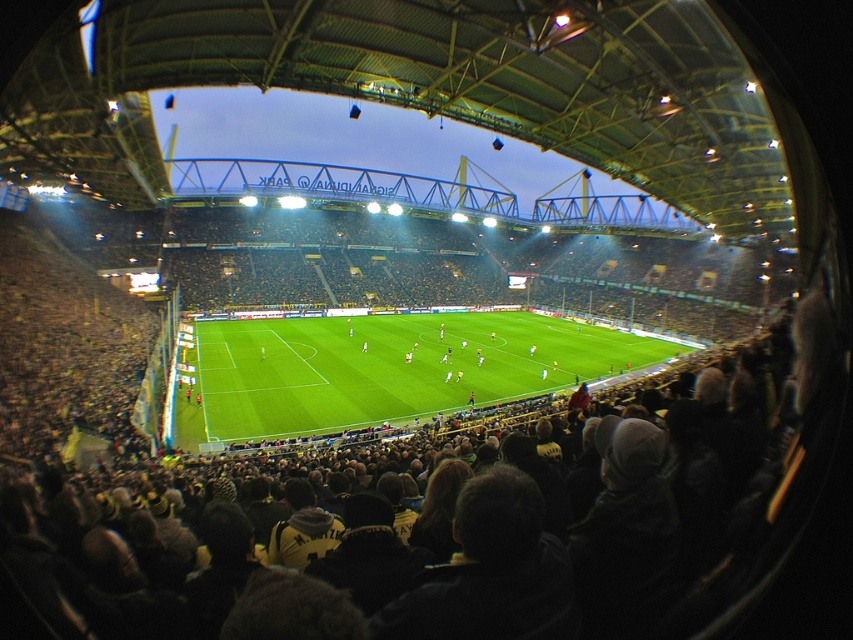
Question: Is black fabric crowd at center above green grass football field at center?

Choices:
 (A) no
 (B) yes

Answer: (A)

Question: Which object is farther from the camera taking this photo?

Choices:
 (A) black fabric crowd at center
 (B) green grass football field at center

Answer: (B)

Question: Which point is closer to the camera?

Choices:
 (A) (523, 365)
 (B) (799, 340)

Answer: (B)

Question: Does black fabric crowd at center appear under green grass football field at center?

Choices:
 (A) yes
 (B) no

Answer: (A)

Question: Is black fabric crowd at center wider than green grass football field at center?

Choices:
 (A) yes
 (B) no

Answer: (B)